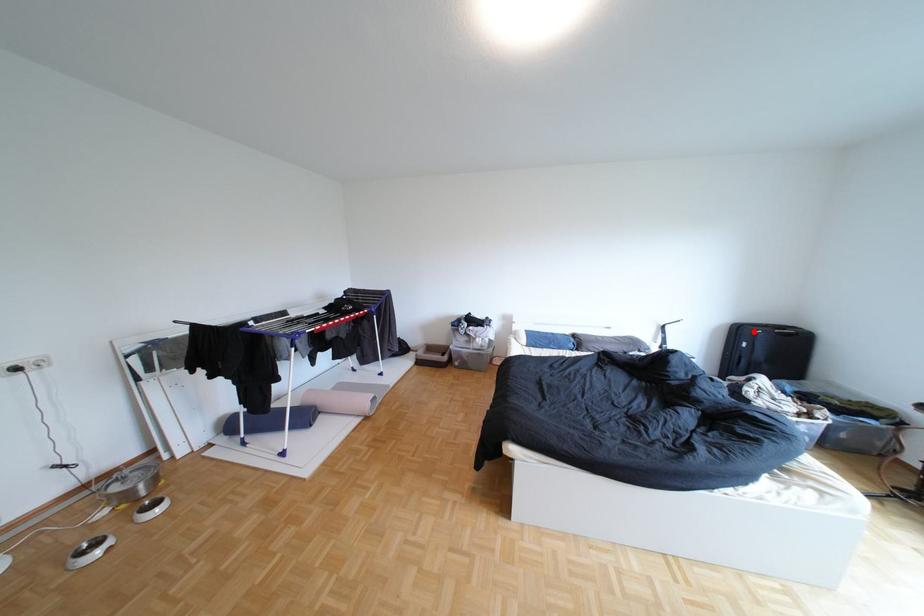
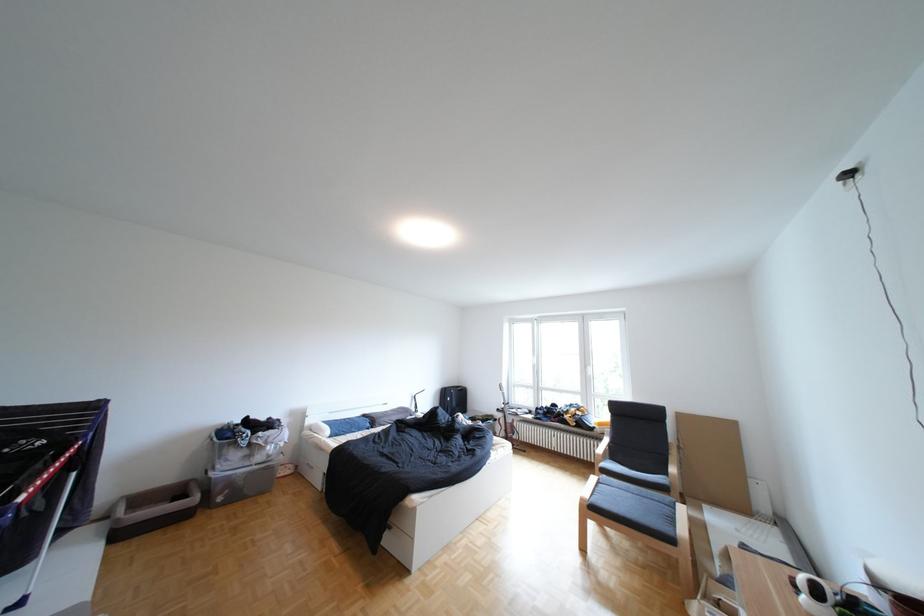
Question: I am providing you with two images of the same scene from different viewpoints. Image1 has a red point marked. In image2, the corresponding 3D location appears at what relative position? Reply with the corresponding letter.

Choices:
 (A) Closer
 (B) Farther

Answer: (B)